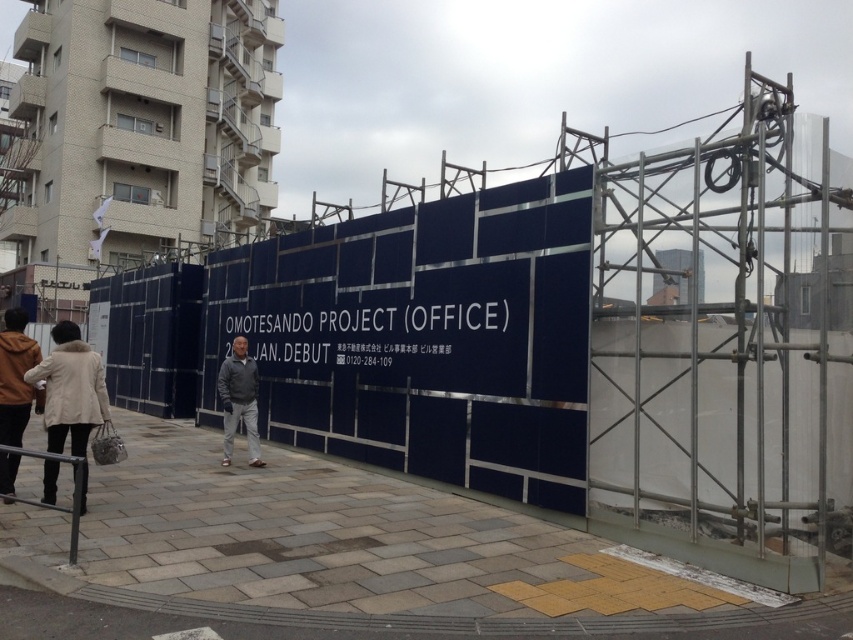
Question: Is beige wool coat at lower left positioned at the back of dark gray jacket at center?

Choices:
 (A) yes
 (B) no

Answer: (B)

Question: Observing the image, what is the correct spatial positioning of beige wool coat at lower left in reference to dark gray jacket at center?

Choices:
 (A) right
 (B) left

Answer: (B)

Question: Can you confirm if beige wool coat at lower left is positioned above dark gray jacket at center?

Choices:
 (A) no
 (B) yes

Answer: (B)

Question: Which point is closer to the camera taking this photo?

Choices:
 (A) (224, 417)
 (B) (38, 369)

Answer: (B)

Question: Which of the following is the farthest from the observer?

Choices:
 (A) dark gray jacket at center
 (B) beige wool coat at lower left

Answer: (A)